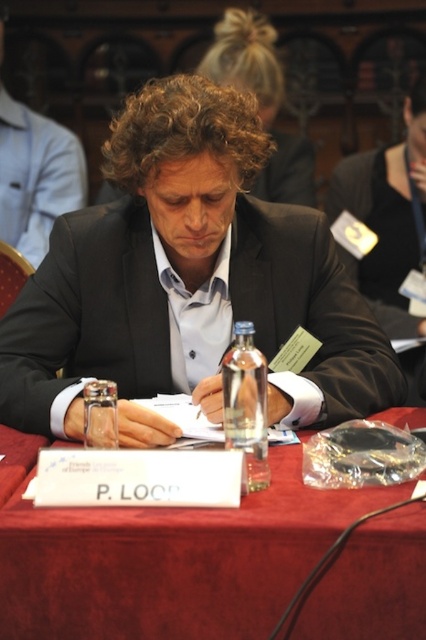
You are standing in front of the table and want to reach both points on the table. Which point, point (180, 566) or point (103, 493), is closer to you?

Point (180, 566) is closer to the viewer than point (103, 493).

Based on the photo, you are an event organizer who needs to ensure that all guests are wearing the correct attire. You notice two suits at the center of the table labeled as black matte suit at center and matte black suit at center. Which one is shorter?

The black matte suit at center is shorter than the matte black suit at center.

You are a waiter at a formal event and need to place a 7.5 inch long decorative ribbon between the red velvet table at center and the white paper at center. Can the ribbon fit between them without overlapping either object?

The red velvet table at center and white paper at center are 7.61 inches apart. Since the ribbon is 7.5 inches long, it can fit between them without overlapping either object because the distance between the two objects is slightly larger than the ribbon.